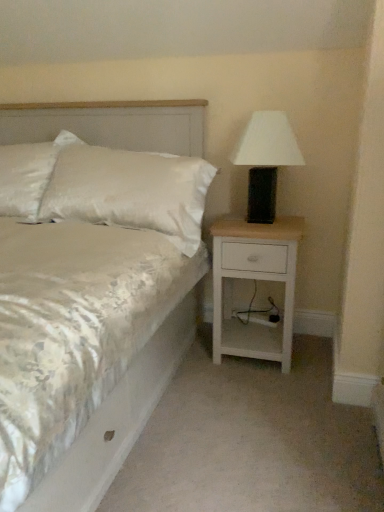
Question: Does white satin bed at center have a greater height compared to white wood nightstand at right?

Choices:
 (A) no
 (B) yes

Answer: (B)

Question: From a real-world perspective, is white satin bed at center positioned over white wood nightstand at right based on gravity?

Choices:
 (A) no
 (B) yes

Answer: (B)

Question: Is white satin bed at center at the left side of white wood nightstand at right?

Choices:
 (A) no
 (B) yes

Answer: (B)

Question: Does white satin bed at center come in front of white wood nightstand at right?

Choices:
 (A) no
 (B) yes

Answer: (B)

Question: From the image's perspective, would you say white satin bed at center is positioned over white wood nightstand at right?

Choices:
 (A) no
 (B) yes

Answer: (B)

Question: Is white wood nightstand at right surrounded by white satin bed at center?

Choices:
 (A) yes
 (B) no

Answer: (B)

Question: Is white satin bed at center thinner than white matte table lamp at right?

Choices:
 (A) yes
 (B) no

Answer: (B)

Question: Could white matte table lamp at right be considered to be inside white satin bed at center?

Choices:
 (A) no
 (B) yes

Answer: (A)

Question: Considering the relative positions of white satin bed at center and white matte table lamp at right in the image provided, is white satin bed at center to the left of white matte table lamp at right from the viewer's perspective?

Choices:
 (A) yes
 (B) no

Answer: (A)

Question: Can you confirm if white satin bed at center is wider than white matte table lamp at right?

Choices:
 (A) no
 (B) yes

Answer: (B)

Question: Is white satin bed at center to the right of white matte table lamp at right from the viewer's perspective?

Choices:
 (A) yes
 (B) no

Answer: (B)

Question: Can you confirm if white satin bed at center is bigger than white matte table lamp at right?

Choices:
 (A) no
 (B) yes

Answer: (B)

Question: Does satin white pillow at upper left have a larger size compared to white wood nightstand at right?

Choices:
 (A) yes
 (B) no

Answer: (A)